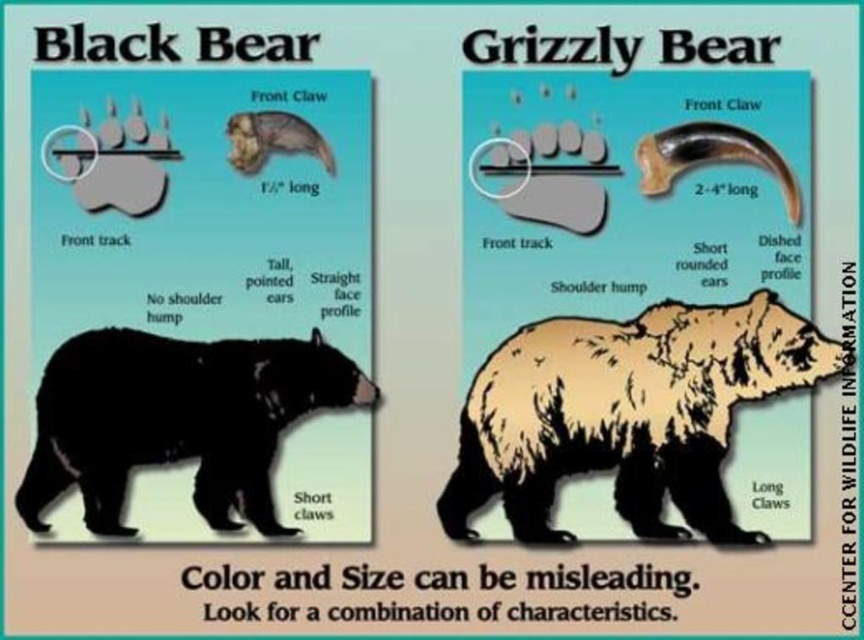
You are an animal researcher observing the educational diagram comparing two bear species. You notice the brown furry bear at center and the black matte bear at lower left. Which bear appears bigger in the diagram?

The brown furry bear at center is larger than the black matte bear at lower left in the diagram.

You are a wildlife researcher observing the educational diagram comparing two bear species. You notice the brown furry bear at center and the smooth brown claw at upper center. Which object is taller in the diagram?

The brown furry bear at center is taller than the smooth brown claw at upper center according to the diagram.